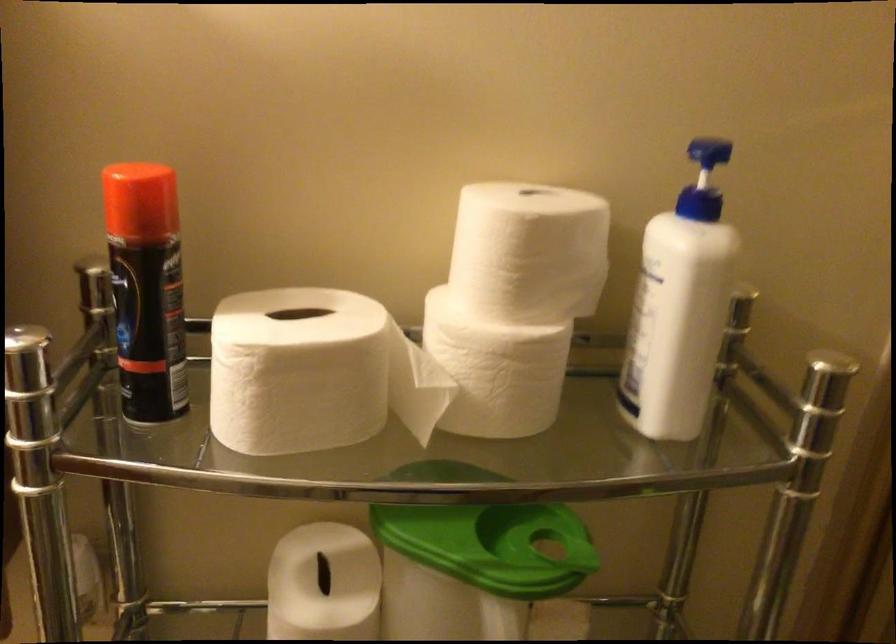
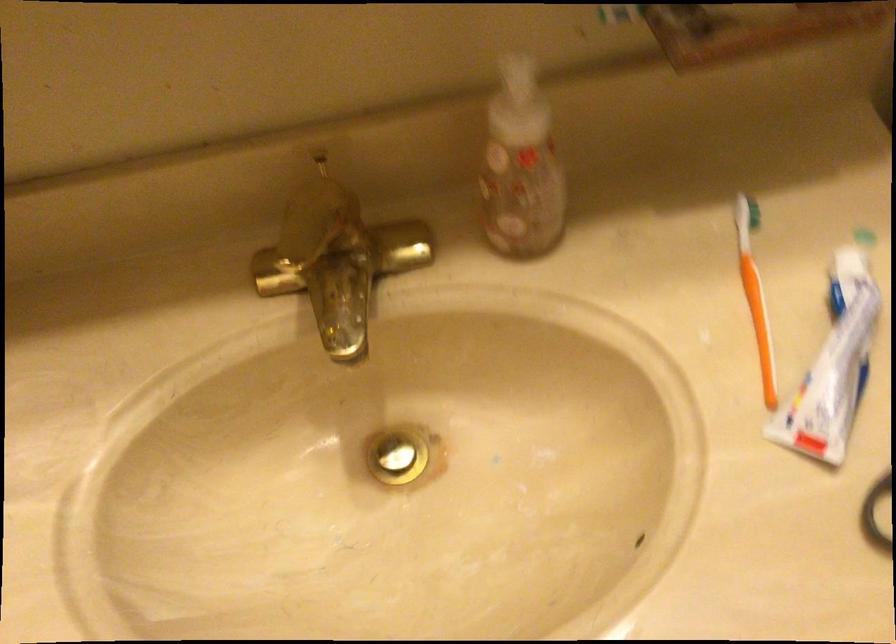
Question: The first image is from the beginning of the video and the second image is from the end. How did the camera likely rotate when shooting the video?

Choices:
 (A) Left
 (B) Right
 (C) Up
 (D) Down

Answer: (D)